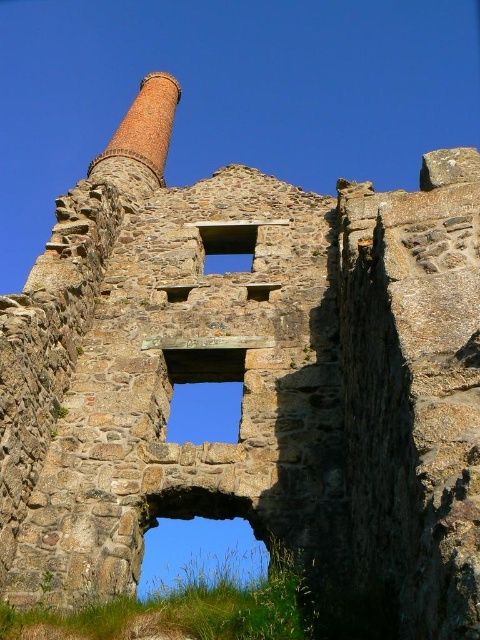
Who is more forward, (160, 77) or (214, 262)?

Point (214, 262) is more forward.

Between point (131, 150) and point (204, 250), which one is positioned in front?

Point (204, 250) is more forward.

Where is `brick chimney at upper center`? brick chimney at upper center is located at coordinates (145, 125).

In the scene shown: Can you confirm if transparent stone window at center is positioned to the right of blue glass window at center?

No, transparent stone window at center is not to the right of blue glass window at center.

How distant is transparent stone window at center from blue glass window at center?

transparent stone window at center and blue glass window at center are 32.32 meters apart from each other.

Locate an element on the screen. Image resolution: width=480 pixels, height=640 pixels. transparent stone window at center is located at coordinates (204, 394).

Can you confirm if transparent stone window at center is positioned to the right of brick chimney at upper center?

Correct, you'll find transparent stone window at center to the right of brick chimney at upper center.

Which is behind, point (228, 378) or point (149, 148)?

Point (149, 148)

What are the coordinates of `transparent stone window at center` in the screenshot? It's located at (204, 394).